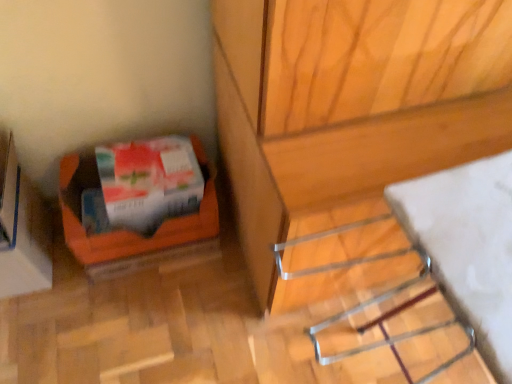
Find the location of a particular element. This screenshot has width=512, height=384. free spot in front of orange cardboard box at lower left is located at coordinates (133, 310).